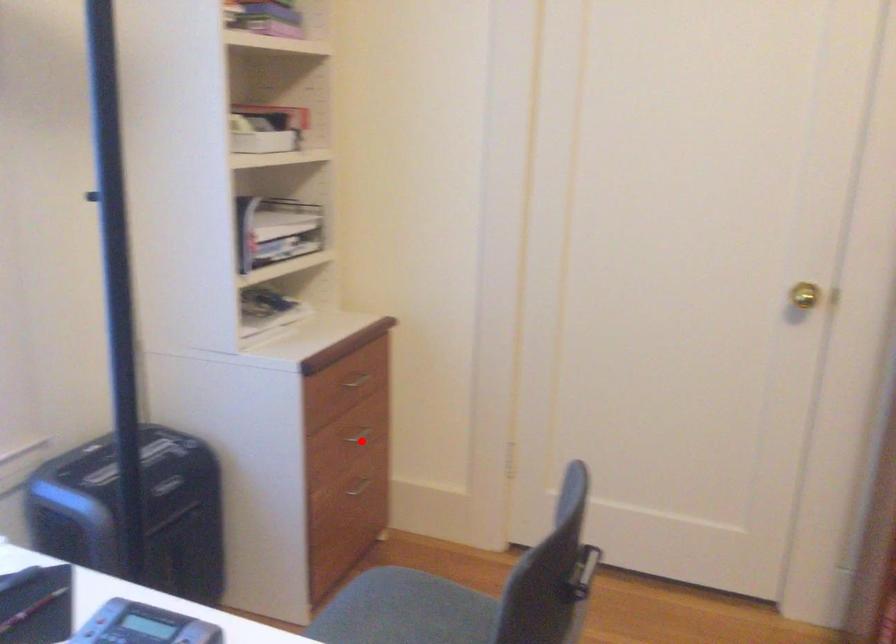
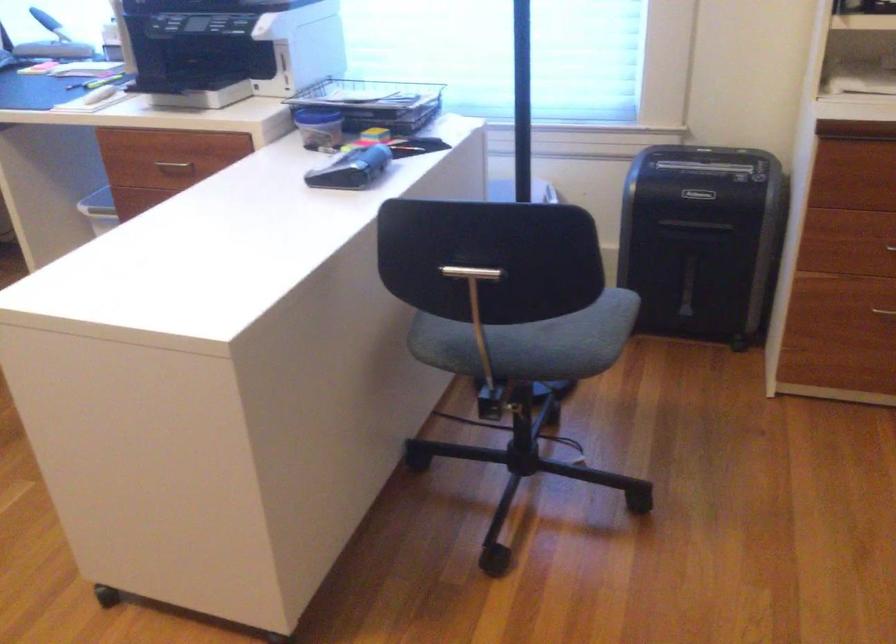
In the second image, find the point that corresponds to the highlighted location in the first image.

(890, 247)